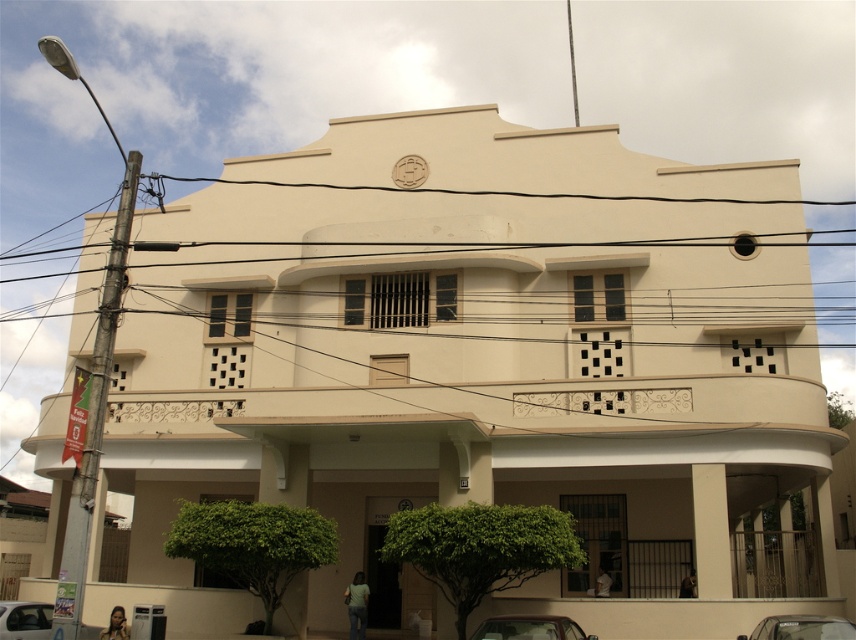
Question: Does metallic silver car at lower right have a larger size compared to metallic silver car at lower left?

Choices:
 (A) yes
 (B) no

Answer: (B)

Question: Does metallic silver car at lower center have a lesser width compared to metallic silver car at lower right?

Choices:
 (A) no
 (B) yes

Answer: (A)

Question: Which of the following is the farthest from the observer?

Choices:
 (A) metallic silver car at lower right
 (B) metallic silver car at lower left
 (C) metallic silver car at lower center

Answer: (B)

Question: Considering the relative positions of black wire at upper center and metallic silver car at lower right in the image provided, where is black wire at upper center located with respect to metallic silver car at lower right?

Choices:
 (A) below
 (B) above

Answer: (B)

Question: Which object is farther from the camera taking this photo?

Choices:
 (A) metallic silver car at lower left
 (B) metallic silver car at lower center
 (C) black wire at upper center
 (D) metallic silver car at lower right

Answer: (A)

Question: Which of these objects is positioned closest to the black wire at upper center?

Choices:
 (A) metallic silver car at lower left
 (B) metallic silver car at lower right

Answer: (A)